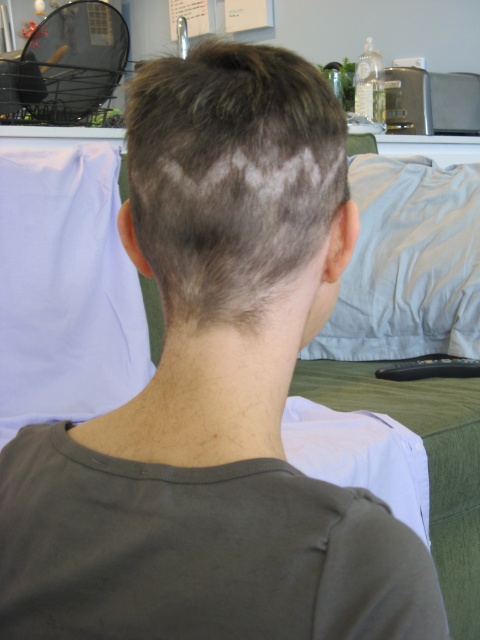
Which of these two, dark brown hair at center or black plastic remote at lower center, stands shorter?

black plastic remote at lower center is shorter.

Describe the element at coordinates (230, 176) in the screenshot. I see `dark brown hair at center` at that location.

At what (x,y) coordinates should I click in order to perform the action: click on dark brown hair at center. Please return your answer as a coordinate pair (x, y). Looking at the image, I should click on (230, 176).